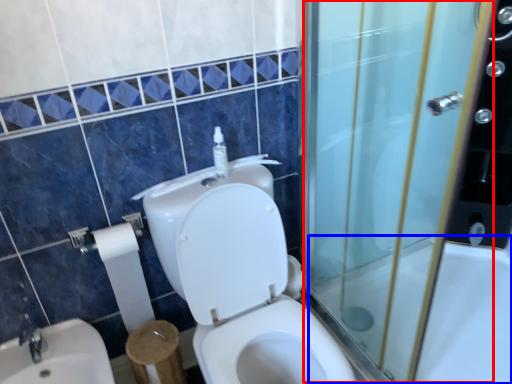
Question: Which object is closer to the camera taking this photo, screen door (highlighted by a red box) or bath (highlighted by a blue box)?

Choices:
 (A) screen door
 (B) bath

Answer: (A)